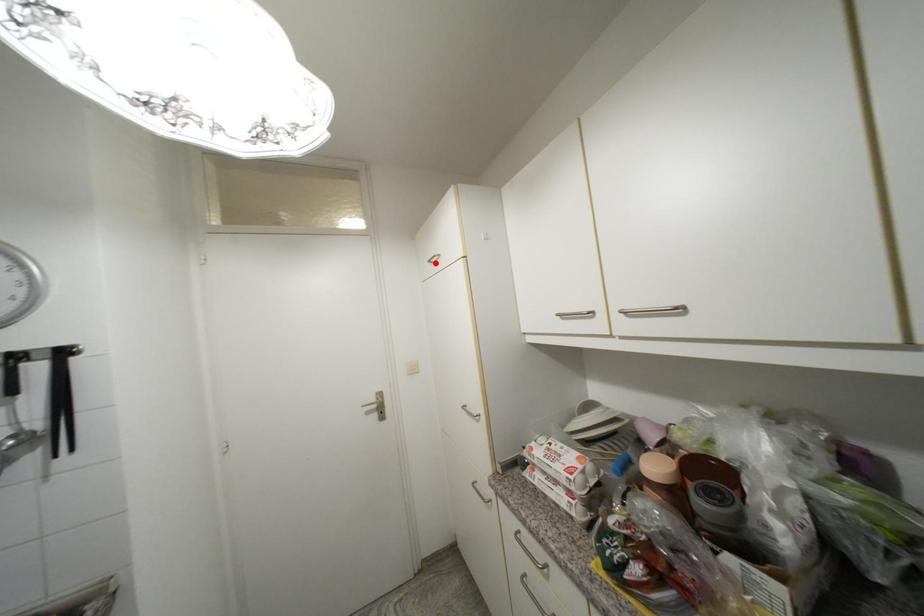
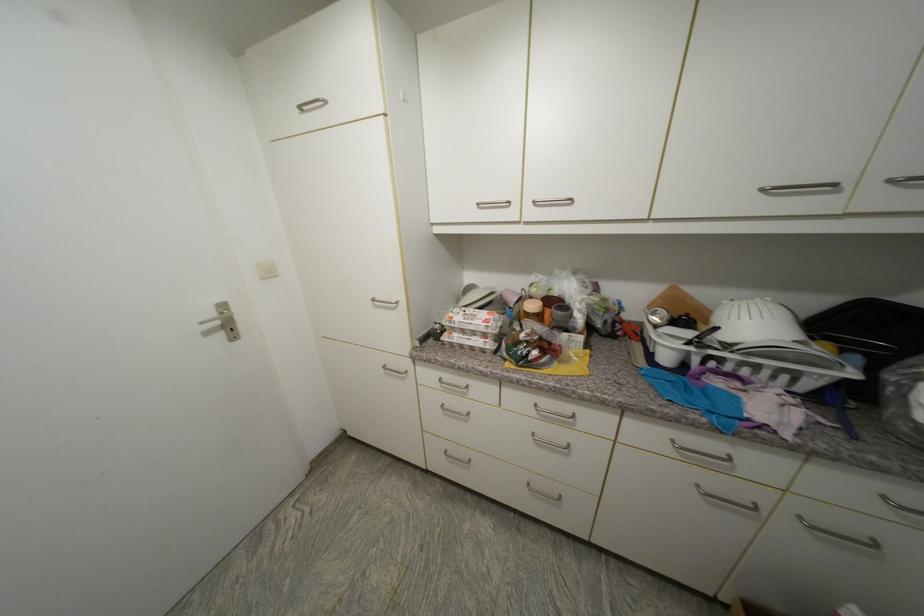
Locate, in the second image, the point that corresponds to the highlighted location in the first image.

(307, 108)